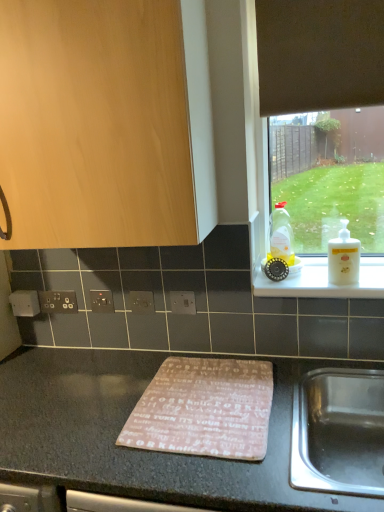
Question: Considering the relative sizes of black plastic electric outlet at center, positioned as the second electric outlet in left-to-right order, and black plastic electrical outlet at lower left, the fourth electric outlet in the right-to-left sequence, in the image provided, is black plastic electric outlet at center, positioned as the second electric outlet in left-to-right order, taller than black plastic electrical outlet at lower left, the fourth electric outlet in the right-to-left sequence,?

Choices:
 (A) no
 (B) yes

Answer: (B)

Question: Is black plastic electric outlet at center, positioned as the third electric outlet in right-to-left order, facing away from black plastic electrical outlet at lower left, the fourth electric outlet in the right-to-left sequence?

Choices:
 (A) yes
 (B) no

Answer: (B)

Question: Can you confirm if black plastic electric outlet at center, positioned as the third electric outlet in right-to-left order, is thinner than black plastic electrical outlet at lower left, marked as the 1th electric outlet in a left-to-right arrangement?

Choices:
 (A) no
 (B) yes

Answer: (B)

Question: Can we say black plastic electric outlet at center, positioned as the second electric outlet in left-to-right order, lies outside black plastic electrical outlet at lower left, marked as the 1th electric outlet in a left-to-right arrangement?

Choices:
 (A) yes
 (B) no

Answer: (A)

Question: Considering the relative positions of black plastic electric outlet at center, positioned as the third electric outlet in right-to-left order, and black plastic electrical outlet at lower left, the fourth electric outlet in the right-to-left sequence, in the image provided, is black plastic electric outlet at center, positioned as the third electric outlet in right-to-left order, in front of black plastic electrical outlet at lower left, the fourth electric outlet in the right-to-left sequence,?

Choices:
 (A) no
 (B) yes

Answer: (B)

Question: From the image's perspective, is black plastic electric outlet at center, positioned as the second electric outlet in left-to-right order, above or below black plastic electrical outlet at lower left, marked as the 1th electric outlet in a left-to-right arrangement?

Choices:
 (A) above
 (B) below

Answer: (A)

Question: Does point (109, 303) appear closer or farther from the camera than point (46, 290)?

Choices:
 (A) farther
 (B) closer

Answer: (B)

Question: Do you think black plastic electric outlet at center, positioned as the second electric outlet in left-to-right order, is within black plastic electrical outlet at lower left, the fourth electric outlet in the right-to-left sequence, or outside of it?

Choices:
 (A) inside
 (B) outside

Answer: (B)

Question: From a real-world perspective, is black plastic electric outlet at center, positioned as the third electric outlet in right-to-left order, positioned above or below black plastic electrical outlet at lower left, the fourth electric outlet in the right-to-left sequence?

Choices:
 (A) below
 (B) above

Answer: (B)

Question: In the image, is granite gray cutting board at center on the left side or the right side of satin silver switch at center, acting as the 2th electric outlet starting from the right?

Choices:
 (A) left
 (B) right

Answer: (B)

Question: Considering the positions of granite gray cutting board at center and satin silver switch at center, which is counted as the third electric outlet, starting from the left, in the image, is granite gray cutting board at center taller or shorter than satin silver switch at center, which is counted as the third electric outlet, starting from the left,?

Choices:
 (A) tall
 (B) short

Answer: (A)

Question: Based on their sizes in the image, would you say granite gray cutting board at center is bigger or smaller than satin silver switch at center, acting as the 2th electric outlet starting from the right?

Choices:
 (A) small
 (B) big

Answer: (B)

Question: From a real-world perspective, is granite gray cutting board at center positioned above or below satin silver switch at center, acting as the 2th electric outlet starting from the right?

Choices:
 (A) below
 (B) above

Answer: (A)

Question: From a real-world perspective, relative to white plastic ledge at upper right, is wooden cabinet at upper left vertically above or below?

Choices:
 (A) below
 (B) above

Answer: (B)

Question: Is wooden cabinet at upper left situated inside white plastic ledge at upper right or outside?

Choices:
 (A) outside
 (B) inside

Answer: (A)